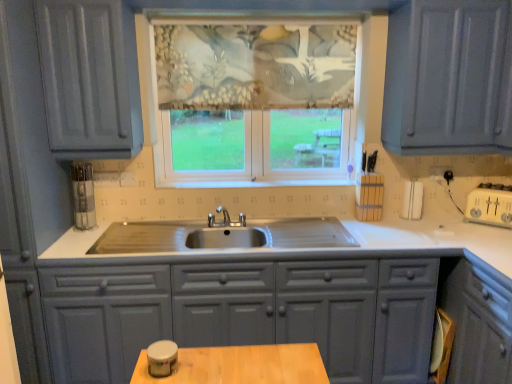
Question: Considering the relative positions of matte gray cabinets at center and textured floral fabric at center in the image provided, is matte gray cabinets at center to the left of textured floral fabric at center from the viewer's perspective?

Choices:
 (A) yes
 (B) no

Answer: (A)

Question: From a real-world perspective, is matte gray cabinets at center under textured floral fabric at center?

Choices:
 (A) no
 (B) yes

Answer: (B)

Question: Can you confirm if matte gray cabinets at center is smaller than textured floral fabric at center?

Choices:
 (A) no
 (B) yes

Answer: (A)

Question: Is matte gray cabinets at center taller than textured floral fabric at center?

Choices:
 (A) yes
 (B) no

Answer: (A)

Question: Considering the relative positions of matte gray cabinets at center and textured floral fabric at center in the image provided, is matte gray cabinets at center behind textured floral fabric at center?

Choices:
 (A) yes
 (B) no

Answer: (B)

Question: Is there a large distance between matte gray cabinets at center and textured floral fabric at center?

Choices:
 (A) no
 (B) yes

Answer: (B)

Question: Is textured floral fabric at center touching textured fabric window at center?

Choices:
 (A) no
 (B) yes

Answer: (B)

Question: Is textured floral fabric at center not close to textured fabric window at center?

Choices:
 (A) no
 (B) yes

Answer: (A)

Question: Does textured floral fabric at center have a larger size compared to textured fabric window at center?

Choices:
 (A) yes
 (B) no

Answer: (B)

Question: From a real-world perspective, does textured floral fabric at center sit lower than textured fabric window at center?

Choices:
 (A) no
 (B) yes

Answer: (A)

Question: From the image's perspective, is textured floral fabric at center on textured fabric window at center?

Choices:
 (A) no
 (B) yes

Answer: (B)

Question: Can you confirm if textured floral fabric at center is shorter than textured fabric window at center?

Choices:
 (A) no
 (B) yes

Answer: (B)

Question: From a real-world perspective, does matte gray cabinets at center sit lower than textured fabric window at center?

Choices:
 (A) yes
 (B) no

Answer: (A)